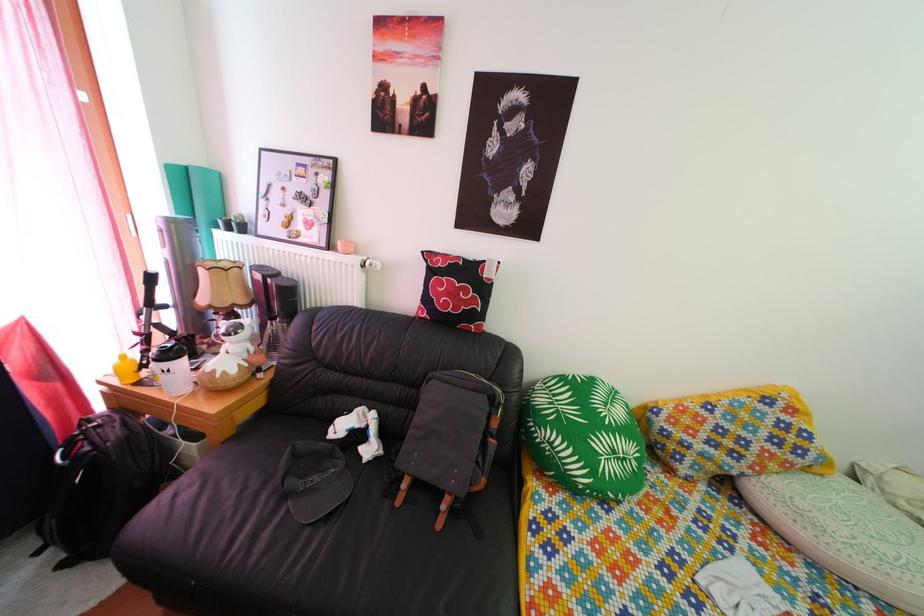
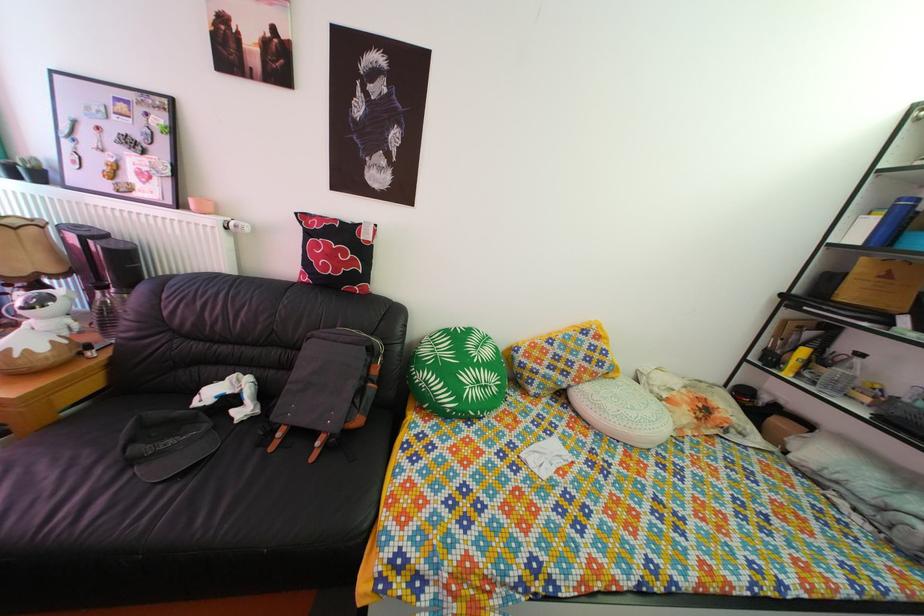
Find the pixel in the second image that matches point (313, 454) in the first image.

(166, 422)